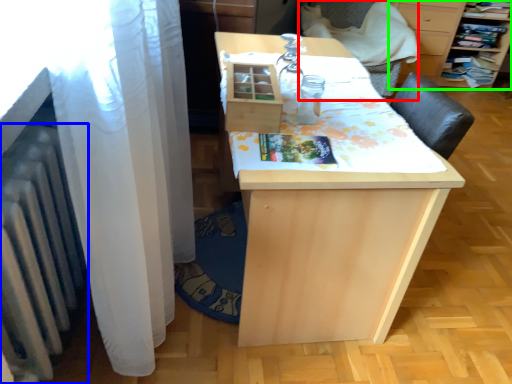
Question: Which object is positioned farthest from armchair (highlighted by a red box)? Select from radiator (highlighted by a blue box) and furniture (highlighted by a green box).

Choices:
 (A) radiator
 (B) furniture

Answer: (A)